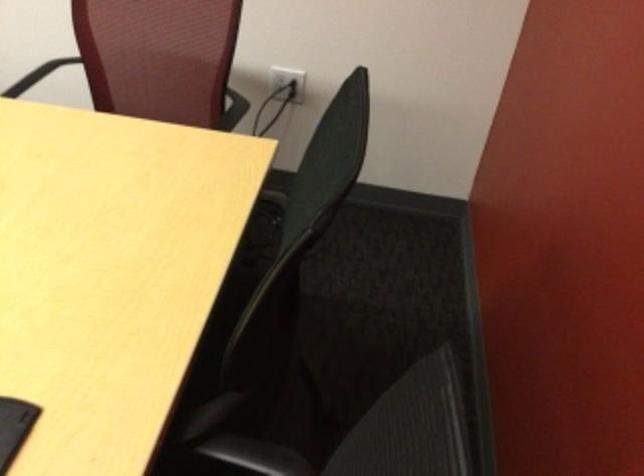
Where would you resting arm the black chair armrest? Please return your answer as a coordinate pair (x, y).

(298, 192)